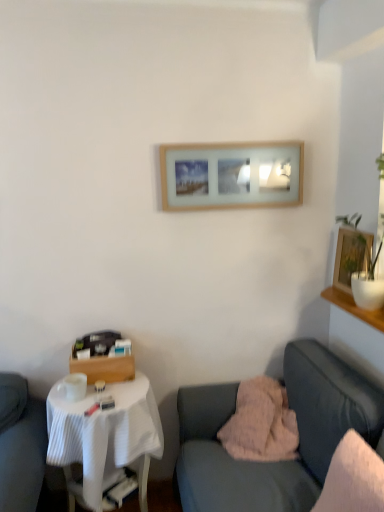
Question: Is white soft pillow at right, the 2th pillow positioned from the back, aimed at wooden framed picture at upper right, the 2th picture frame from the top?

Choices:
 (A) yes
 (B) no

Answer: (B)

Question: Is white soft pillow at right, the first pillow when ordered from front to back, taller than wooden framed picture at upper right, the first picture frame from the right?

Choices:
 (A) yes
 (B) no

Answer: (A)

Question: From the image's perspective, is white soft pillow at right, the first pillow when ordered from front to back, beneath wooden framed picture at upper right, marked as the first picture frame in a bottom-to-top arrangement?

Choices:
 (A) no
 (B) yes

Answer: (B)

Question: Considering the relative sizes of white soft pillow at right, the 2th pillow positioned from the back, and wooden framed picture at upper right, the 2th picture frame from the top, in the image provided, is white soft pillow at right, the 2th pillow positioned from the back, shorter than wooden framed picture at upper right, the 2th picture frame from the top,?

Choices:
 (A) no
 (B) yes

Answer: (A)

Question: From a real-world perspective, is white soft pillow at right, the first pillow when ordered from front to back, positioned under wooden framed picture at upper right, marked as the first picture frame in a bottom-to-top arrangement, based on gravity?

Choices:
 (A) yes
 (B) no

Answer: (A)

Question: From a real-world perspective, is wooden framed picture at upper right, which is the 2th picture frame in left-to-right order, physically located above or below white fabric-covered table at lower left?

Choices:
 (A) above
 (B) below

Answer: (A)

Question: From the image's perspective, relative to white fabric-covered table at lower left, is wooden framed picture at upper right, marked as the first picture frame in a bottom-to-top arrangement, above or below?

Choices:
 (A) above
 (B) below

Answer: (A)

Question: Considering their positions, is wooden framed picture at upper right, the 2th picture frame from the top, located in front of or behind white fabric-covered table at lower left?

Choices:
 (A) behind
 (B) front

Answer: (A)

Question: Is point (342, 249) positioned closer to the camera than point (117, 455)?

Choices:
 (A) closer
 (B) farther

Answer: (B)

Question: Considering the positions of velvet pink blanket at lower right and white soft pillow at right, the 2th pillow positioned from the back, in the image, is velvet pink blanket at lower right wider or thinner than white soft pillow at right, the 2th pillow positioned from the back,?

Choices:
 (A) thin
 (B) wide

Answer: (B)

Question: Is velvet pink blanket at lower right to the left or to the right of white soft pillow at right, the 2th pillow positioned from the back, in the image?

Choices:
 (A) left
 (B) right

Answer: (A)

Question: Is velvet pink blanket at lower right taller or shorter than white soft pillow at right, the 2th pillow positioned from the back?

Choices:
 (A) tall
 (B) short

Answer: (A)

Question: Relative to white soft pillow at right, the 2th pillow positioned from the back, is velvet pink blanket at lower right in front or behind?

Choices:
 (A) front
 (B) behind

Answer: (A)

Question: Considering the positions of fluffy pink pillow at lower center, the first pillow viewed from the back, and velvet pink blanket at lower right in the image, is fluffy pink pillow at lower center, the first pillow viewed from the back, wider or thinner than velvet pink blanket at lower right?

Choices:
 (A) thin
 (B) wide

Answer: (A)

Question: Considering the positions of fluffy pink pillow at lower center, the second pillow positioned from the front, and velvet pink blanket at lower right in the image, is fluffy pink pillow at lower center, the second pillow positioned from the front, taller or shorter than velvet pink blanket at lower right?

Choices:
 (A) short
 (B) tall

Answer: (A)